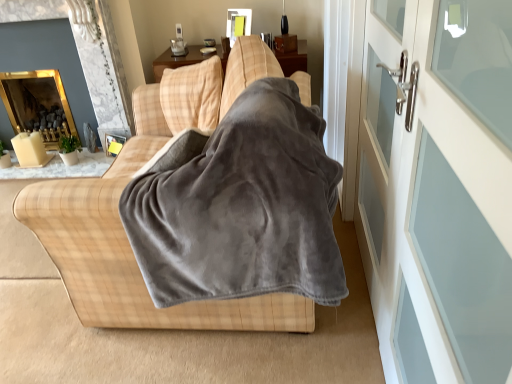
Question: Considering the relative positions of white glass screen door at right, positioned as the 1th screen door in back-to-front order, and gray fleece blanket at center in the image provided, is white glass screen door at right, positioned as the 1th screen door in back-to-front order, in front of gray fleece blanket at center?

Choices:
 (A) no
 (B) yes

Answer: (B)

Question: Is white glass screen door at right, the second screen door when ordered from front to back, shorter than gray fleece blanket at center?

Choices:
 (A) no
 (B) yes

Answer: (A)

Question: Could you tell me if white glass screen door at right, the second screen door when ordered from front to back, is facing gray fleece blanket at center?

Choices:
 (A) no
 (B) yes

Answer: (B)

Question: Is white glass screen door at right, positioned as the 1th screen door in back-to-front order, facing away from gray fleece blanket at center?

Choices:
 (A) no
 (B) yes

Answer: (B)

Question: From the image's perspective, is white glass screen door at right, positioned as the 1th screen door in back-to-front order, on top of gray fleece blanket at center?

Choices:
 (A) yes
 (B) no

Answer: (A)

Question: Is white glass screen door at right, the second screen door when ordered from front to back, positioned far away from gray fleece blanket at center?

Choices:
 (A) no
 (B) yes

Answer: (A)

Question: Considering the relative sizes of gold reflective fireplace at upper left, the 2th fireplace from the back, and white glass screen door at right, the second screen door when ordered from front to back, in the image provided, is gold reflective fireplace at upper left, the 2th fireplace from the back, smaller than white glass screen door at right, the second screen door when ordered from front to back,?

Choices:
 (A) yes
 (B) no

Answer: (B)

Question: Does gold reflective fireplace at upper left, positioned as the first fireplace in front-to-back order, have a lesser height compared to white glass screen door at right, positioned as the 1th screen door in back-to-front order?

Choices:
 (A) yes
 (B) no

Answer: (A)

Question: From the image's perspective, would you say gold reflective fireplace at upper left, the 2th fireplace from the back, is shown under white glass screen door at right, the second screen door when ordered from front to back?

Choices:
 (A) yes
 (B) no

Answer: (B)

Question: Is gold reflective fireplace at upper left, positioned as the first fireplace in front-to-back order, positioned with its back to white glass screen door at right, the second screen door when ordered from front to back?

Choices:
 (A) no
 (B) yes

Answer: (A)

Question: Does gold reflective fireplace at upper left, the 2th fireplace from the back, appear on the left side of white glass screen door at right, positioned as the 1th screen door in back-to-front order?

Choices:
 (A) yes
 (B) no

Answer: (A)

Question: Is gold reflective fireplace at upper left, positioned as the first fireplace in front-to-back order, thinner than white glass screen door at right, positioned as the 1th screen door in back-to-front order?

Choices:
 (A) yes
 (B) no

Answer: (B)

Question: Does gold reflective mirror at upper left, placed as the second fireplace when sorted from front to back, have a larger size compared to white glass door at right, acting as the 1th screen door starting from the front?

Choices:
 (A) no
 (B) yes

Answer: (B)